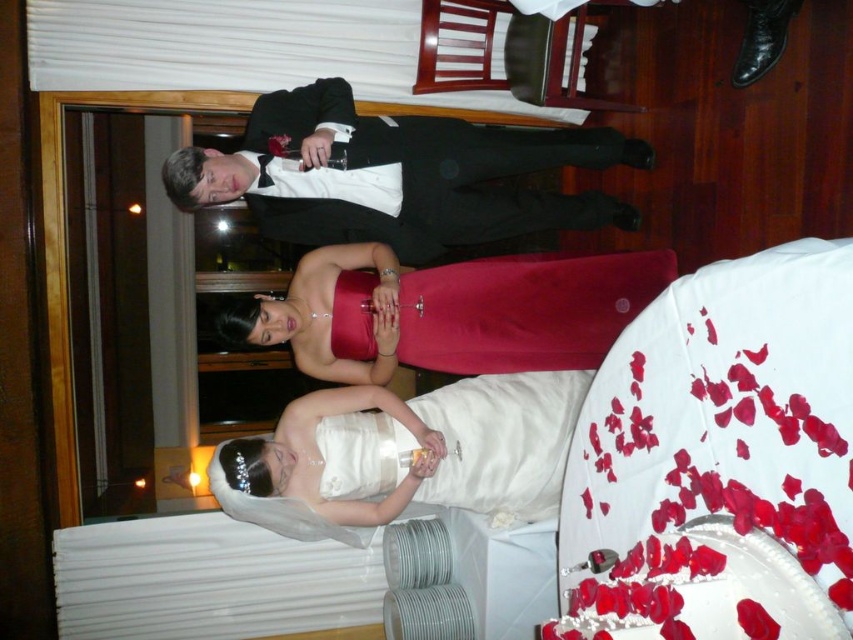
Is satin red dress at center below white satin dress at lower center?

Incorrect, satin red dress at center is not positioned below white satin dress at lower center.

Who is higher up, satin red dress at center or white satin dress at lower center?

satin red dress at center is higher up.

You are a GUI agent. You are given a task and a screenshot of the screen. Output one action in this format:
    pyautogui.click(x=<x>, y=<y>)
    Task: Click on the satin red dress at center
    The height and width of the screenshot is (640, 853).
    Given the screenshot: What is the action you would take?
    pyautogui.click(x=448, y=312)

You are a GUI agent. You are given a task and a screenshot of the screen. Output one action in this format:
    pyautogui.click(x=<x>, y=<y>)
    Task: Click on the satin red dress at center
    
    Given the screenshot: What is the action you would take?
    pyautogui.click(x=448, y=312)

Does point (537, 227) come farther from viewer compared to point (461, 328)?

Yes, point (537, 227) is behind point (461, 328).

Where is `black satin tuxedo at upper center`? Image resolution: width=853 pixels, height=640 pixels. black satin tuxedo at upper center is located at coordinates (398, 176).

Which is in front, point (462, 230) or point (326, 310)?

Positioned in front is point (326, 310).

Where is `black satin tuxedo at upper center`? The height and width of the screenshot is (640, 853). black satin tuxedo at upper center is located at coordinates (398, 176).

Is black satin tuxedo at upper center in front of white satin dress at lower center?

Yes, it is in front of white satin dress at lower center.

Who is more forward, (x=405, y=189) or (x=282, y=484)?

Positioned in front is point (x=282, y=484).

Where is `black satin tuxedo at upper center`? black satin tuxedo at upper center is located at coordinates [398, 176].